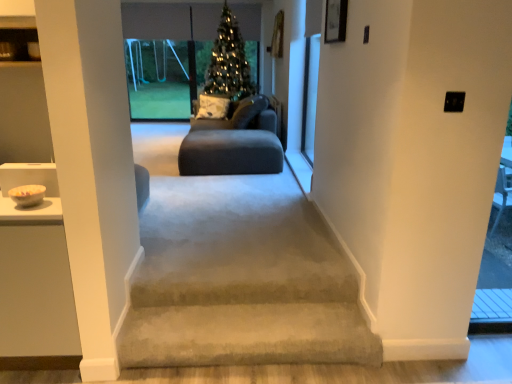
Locate an element on the screen. This screenshot has width=512, height=384. vacant space in front of suede-like dark gray sofa at center is located at coordinates (230, 185).